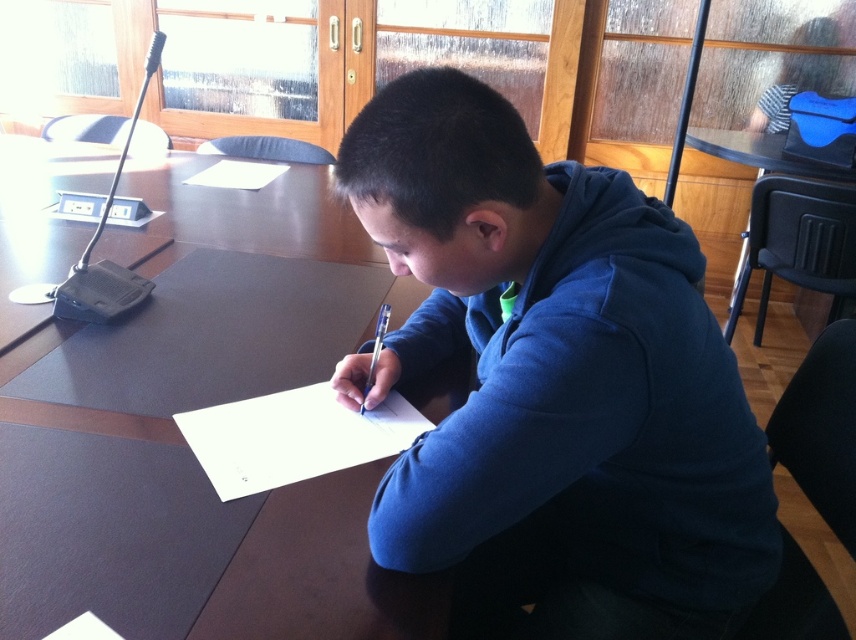
Is dark brown wood table at center closer to camera compared to transparent glass table at center?

Yes, dark brown wood table at center is closer to the viewer.

Is point (96, 481) positioned in front of point (756, 193)?

Yes.

Where is `dark brown wood table at center`? The image size is (856, 640). dark brown wood table at center is located at coordinates (189, 465).

Can you confirm if blue fleece jacket at center is wider than dark brown wood table at center?

In fact, blue fleece jacket at center might be narrower than dark brown wood table at center.

What do you see at coordinates (556, 384) in the screenshot?
I see `blue fleece jacket at center` at bounding box center [556, 384].

Does point (559, 576) lie behind point (76, 490)?

Yes, point (559, 576) is farther from viewer.

Where is `blue fleece jacket at center`? The width and height of the screenshot is (856, 640). blue fleece jacket at center is located at coordinates (556, 384).

Does blue fleece jacket at center appear under transparent glass table at center?

Yes, blue fleece jacket at center is below transparent glass table at center.

Does point (522, 362) lie in front of point (854, 234)?

Yes, point (522, 362) is closer to viewer.

Identify the location of blue fleece jacket at center. The width and height of the screenshot is (856, 640). (556, 384).